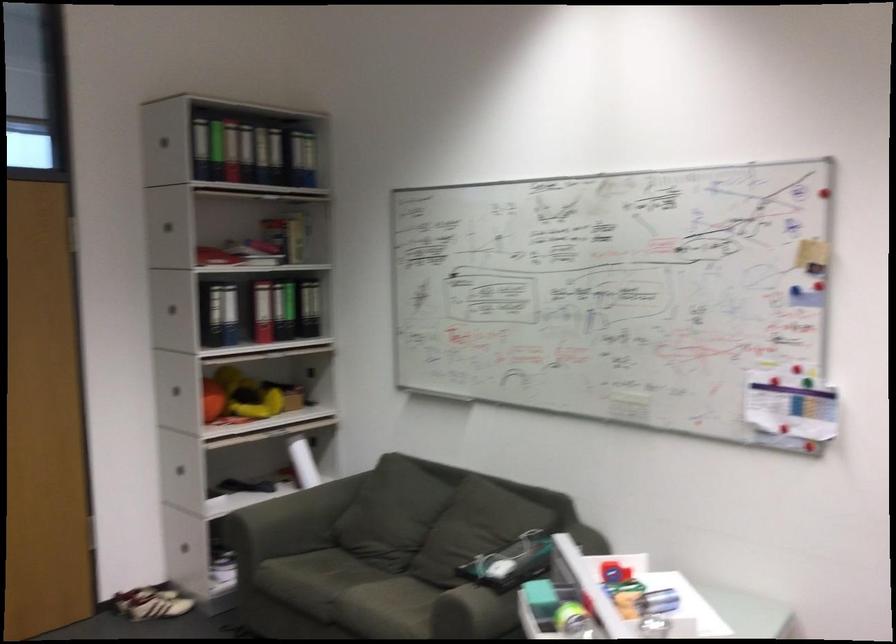
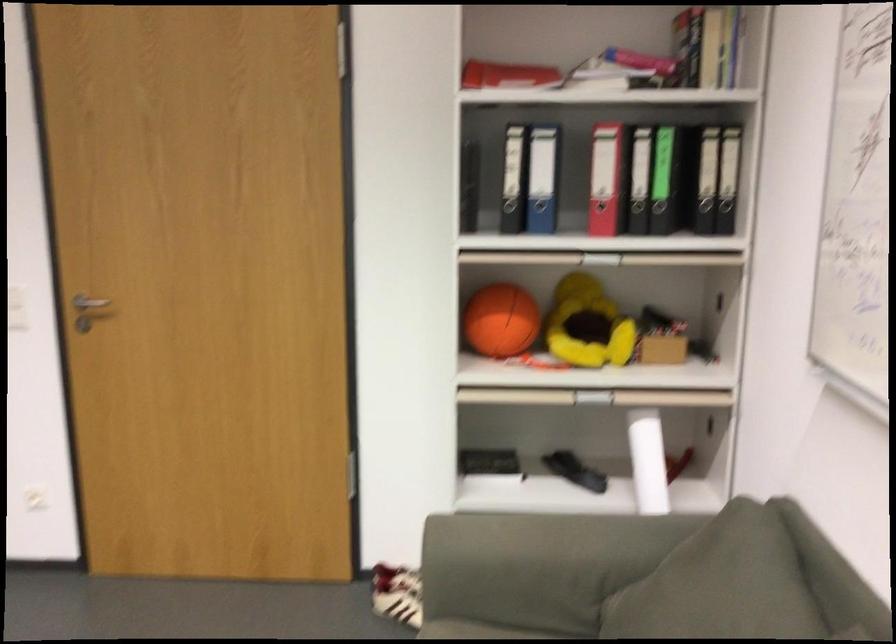
The point at [225,344] is marked in the first image. Where is the corresponding point in the second image?

(539, 216)